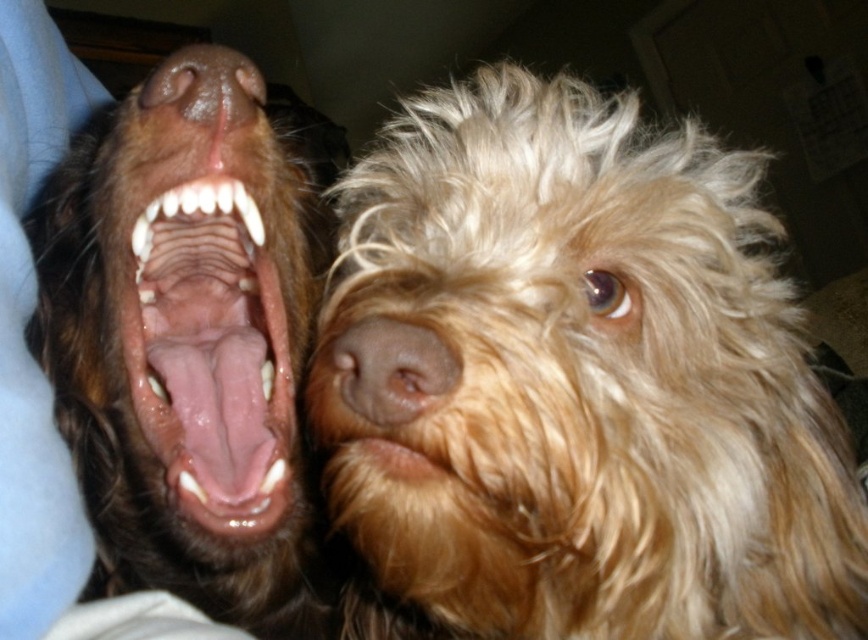
Consider the image. How distant is pink flesh-colored teeth at left from pink smooth nose at upper left?

They are 5.10 inches apart.

Is the position of pink flesh-colored teeth at left more distant than that of pink smooth nose at upper left?

No, it is not.

This screenshot has width=868, height=640. What do you see at coordinates (211, 355) in the screenshot?
I see `pink flesh-colored teeth at left` at bounding box center [211, 355].

This screenshot has width=868, height=640. I want to click on pink flesh-colored teeth at left, so click(211, 355).

Who is lower down, pink smooth nose at upper left or dry fur at center?

Positioned lower is dry fur at center.

Can you confirm if pink smooth nose at upper left is smaller than dry fur at center?

No.

Is point (214, 108) farther from camera compared to point (408, 467)?

Yes, it is behind point (408, 467).

Locate an element on the screen. pink smooth nose at upper left is located at coordinates pyautogui.click(x=205, y=84).

Is brown soft fur nose at center taller than pink smooth nose at upper left?

Incorrect, brown soft fur nose at center's height is not larger of pink smooth nose at upper left's.

Is brown soft fur nose at center bigger than pink smooth nose at upper left?

No.

Does point (406, 380) come in front of point (189, 83)?

Yes, point (406, 380) is closer to viewer.

I want to click on brown soft fur nose at center, so click(392, 369).